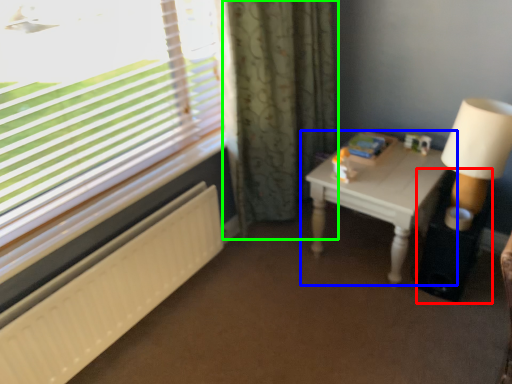
Question: Which object is positioned farthest from side table (highlighted by a red box)? Select from table (highlighted by a blue box) and curtain (highlighted by a green box).

Choices:
 (A) table
 (B) curtain

Answer: (B)